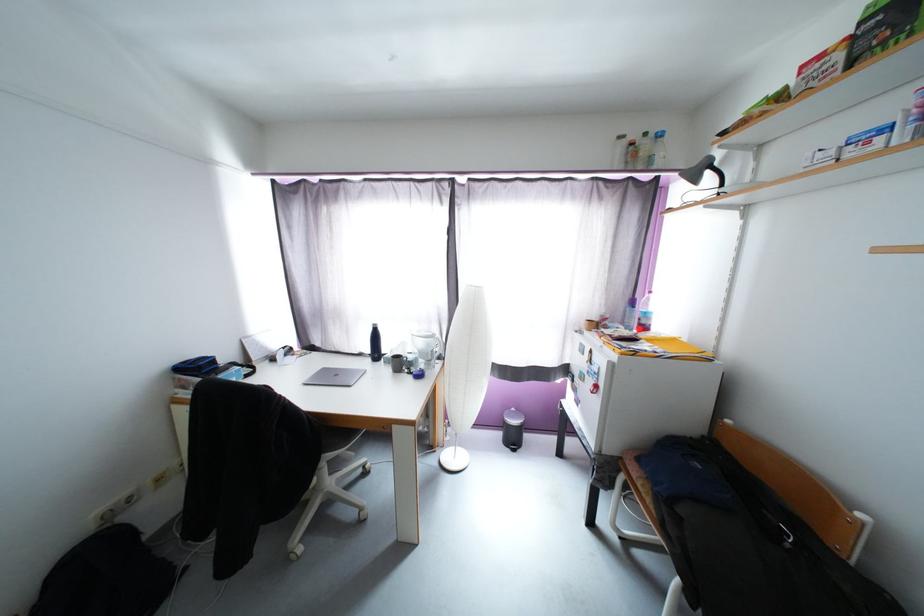
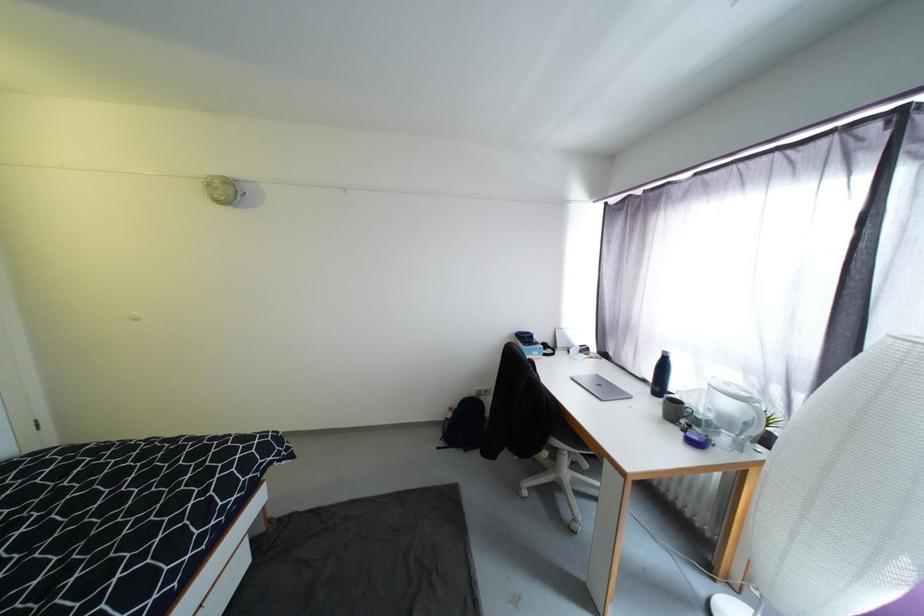
In the second image, find the point that corresponds to pixel 374 361 in the first image.

(654, 392)